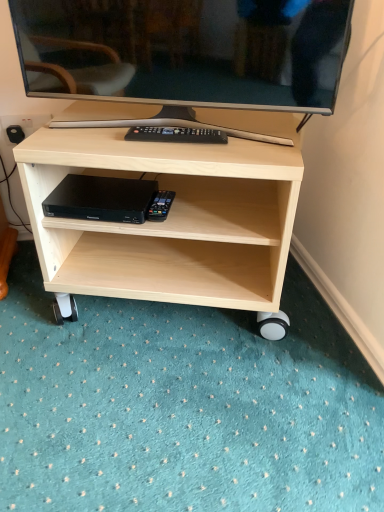
The height and width of the screenshot is (512, 384). In order to click on free spot above black plastic dvd player at lower center (from a real-world perspective) in this screenshot , I will do `click(113, 188)`.